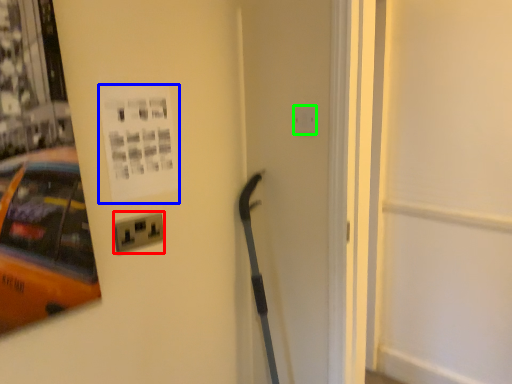
Question: Which object is the farthest from electric outlet (highlighted by a red box)? Choose among these: poster page (highlighted by a blue box) or electric outlet (highlighted by a green box).

Choices:
 (A) poster page
 (B) electric outlet

Answer: (B)